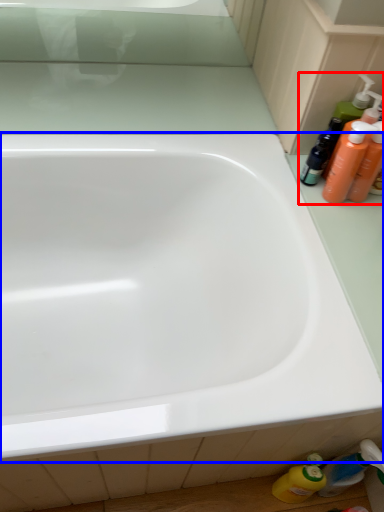
Question: Which of the following is the farthest to the observer, toiletry (highlighted by a red box) or bathtub (highlighted by a blue box)?

Choices:
 (A) toiletry
 (B) bathtub

Answer: (A)